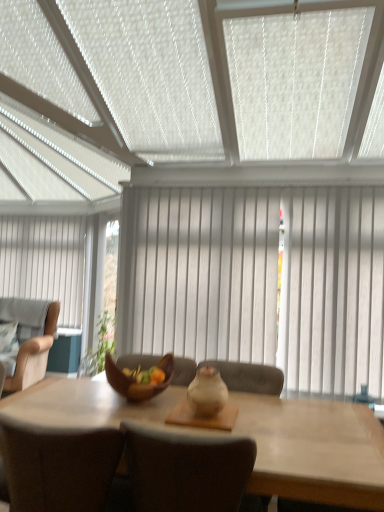
Question: From the image's perspective, is white wood curtain at center, arranged as the first curtain when viewed from the right, located beneath light brown wooden table at center?

Choices:
 (A) yes
 (B) no

Answer: (B)

Question: From a real-world perspective, is white wood curtain at center, positioned as the second curtain in left-to-right order, beneath light brown wooden table at center?

Choices:
 (A) no
 (B) yes

Answer: (A)

Question: Is white wood curtain at center, the second curtain in the back-to-front sequence, facing towards light brown wooden table at center?

Choices:
 (A) no
 (B) yes

Answer: (B)

Question: Is white wood curtain at center, positioned as the second curtain in left-to-right order, bigger than light brown wooden table at center?

Choices:
 (A) yes
 (B) no

Answer: (B)

Question: Is white wood curtain at center, the second curtain in the back-to-front sequence, facing away from light brown wooden table at center?

Choices:
 (A) no
 (B) yes

Answer: (A)

Question: Considering the relative sizes of white wood curtain at center, positioned as the second curtain in left-to-right order, and light brown wooden table at center in the image provided, is white wood curtain at center, positioned as the second curtain in left-to-right order, taller than light brown wooden table at center?

Choices:
 (A) no
 (B) yes

Answer: (B)

Question: Is white fabric curtain at left, which is the first curtain in back-to-front order, bigger than white wood curtain at center, arranged as the first curtain when viewed from the right?

Choices:
 (A) yes
 (B) no

Answer: (B)

Question: Is white fabric curtain at left, placed as the 1th curtain when sorted from left to right, to the right of white wood curtain at center, the second curtain in the back-to-front sequence, from the viewer's perspective?

Choices:
 (A) no
 (B) yes

Answer: (A)

Question: Is white fabric curtain at left, placed as the 1th curtain when sorted from left to right, in contact with white wood curtain at center, the second curtain in the back-to-front sequence?

Choices:
 (A) no
 (B) yes

Answer: (A)

Question: From the image's perspective, is white fabric curtain at left, which ranks as the second curtain in front-to-back order, over white wood curtain at center, positioned as the second curtain in left-to-right order?

Choices:
 (A) yes
 (B) no

Answer: (A)

Question: Considering the relative sizes of white fabric curtain at left, which is the first curtain in back-to-front order, and white wood curtain at center, arranged as the first curtain when viewed from the right, in the image provided, is white fabric curtain at left, which is the first curtain in back-to-front order, taller than white wood curtain at center, arranged as the first curtain when viewed from the right,?

Choices:
 (A) yes
 (B) no

Answer: (B)

Question: Is the depth of white fabric curtain at left, which ranks as the second curtain in front-to-back order, greater than that of white wood curtain at center, positioned as the second curtain in left-to-right order?

Choices:
 (A) no
 (B) yes

Answer: (B)

Question: From the image's perspective, does white textured window blind at upper center appear lower than white wood curtain at center, positioned as the second curtain in left-to-right order?

Choices:
 (A) yes
 (B) no

Answer: (B)